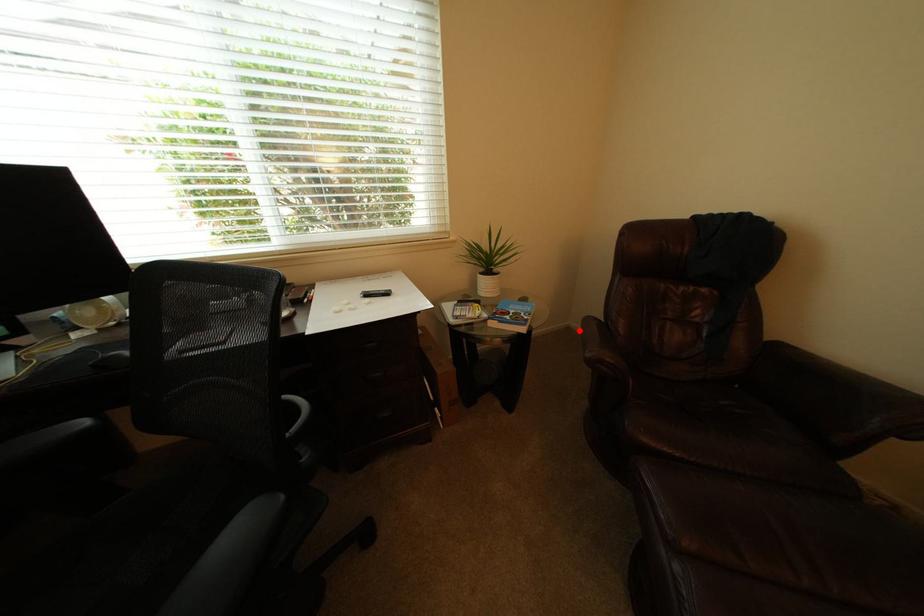
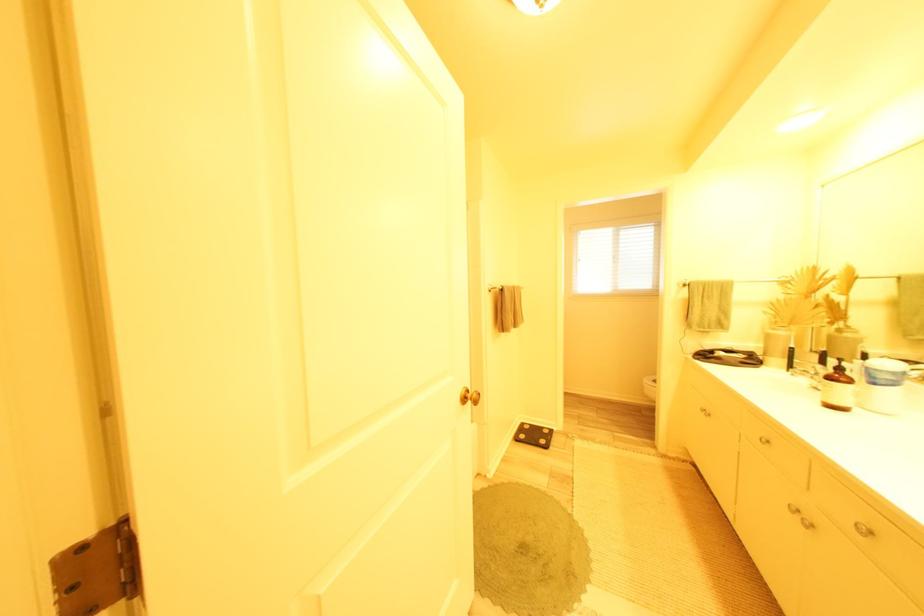
Question: I am providing you with two images of the same scene from different viewpoints. A red point is marked on the first image. Is the red point's position out of view in image 2?

Choices:
 (A) Yes
 (B) No

Answer: (A)